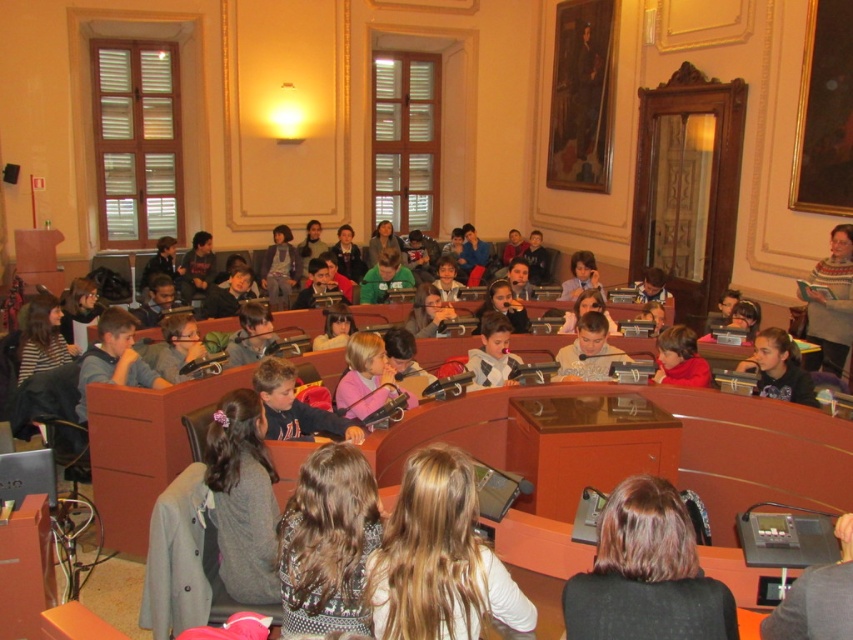
Question: Which of the following is the closest to the observer?

Choices:
 (A) (495, 609)
 (B) (653, 488)

Answer: (B)

Question: Does blonde hair at center have a lesser width compared to brown hair at center?

Choices:
 (A) no
 (B) yes

Answer: (A)

Question: Is blonde hair at center to the right of brown hair at center from the viewer's perspective?

Choices:
 (A) no
 (B) yes

Answer: (A)

Question: Can you confirm if blonde hair at center is positioned to the right of brown hair at center?

Choices:
 (A) no
 (B) yes

Answer: (A)

Question: Which point appears farthest from the camera in this image?

Choices:
 (A) (408, 458)
 (B) (584, 573)

Answer: (A)

Question: Which point is closer to the camera?

Choices:
 (A) brown hair at center
 (B) blonde hair at center

Answer: (A)